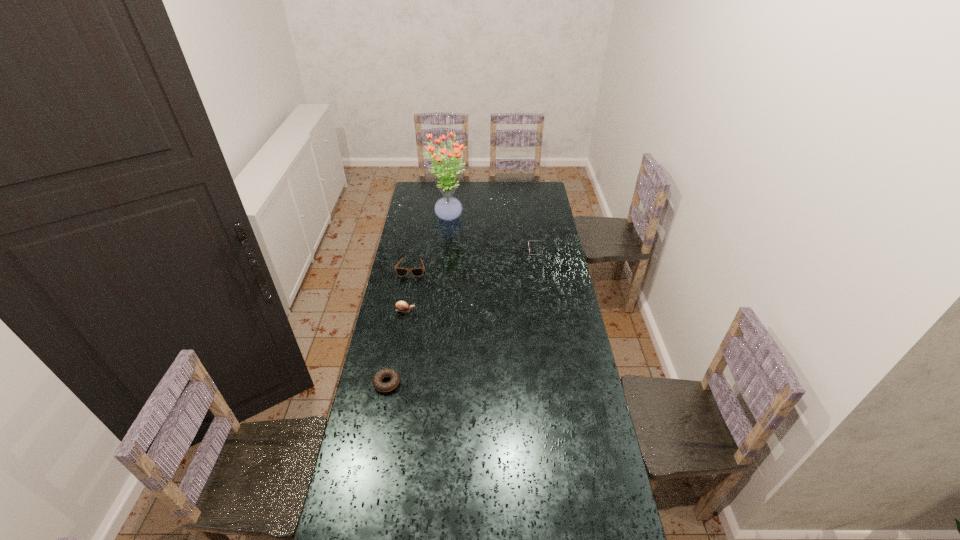
Where is `empty location between the left sunglasses and the shortest object`? empty location between the left sunglasses and the shortest object is located at coordinates (399, 326).

At what (x,y) coordinates should I click in order to perform the action: click on unoccupied area between the farther sunglasses and the doughnut. Please return your answer as a coordinate pair (x, y). The image size is (960, 540). Looking at the image, I should click on (464, 317).

Identify the location of vacant space that's between the second nearest object and the left sunglasses. The image size is (960, 540). (408, 289).

Locate an element on the screen. The height and width of the screenshot is (540, 960). unoccupied area between the escargot and the tallest object is located at coordinates (426, 264).

The image size is (960, 540). What are the coordinates of `vacant point located between the flower arrangement and the farther sunglasses` in the screenshot? It's located at (493, 234).

Select which object is the third closest to the doughnut. Please provide its 2D coordinates. Your answer should be formatted as a tuple, i.e. [(x, y)], where the tuple contains the x and y coordinates of a point satisfying the conditions above.

[(528, 241)]

Where is `object that is the second closest to the second nearest object`? The width and height of the screenshot is (960, 540). object that is the second closest to the second nearest object is located at coordinates (386, 372).

Locate an element on the screen. The width and height of the screenshot is (960, 540). blank area in the image that satisfies the following two spatial constraints: 1. on the front-facing side of the rightmost object; 2. on the front side of the nearest object is located at coordinates (562, 383).